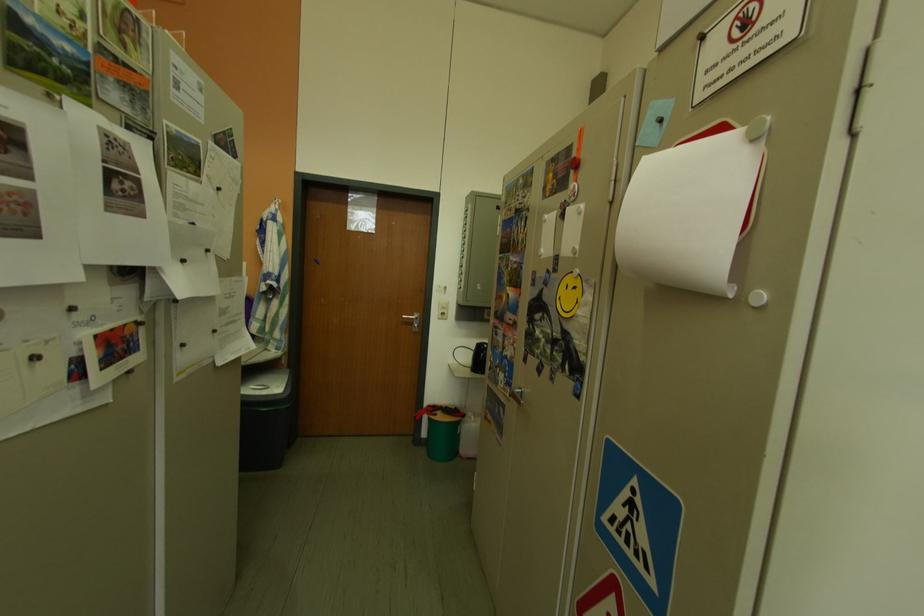
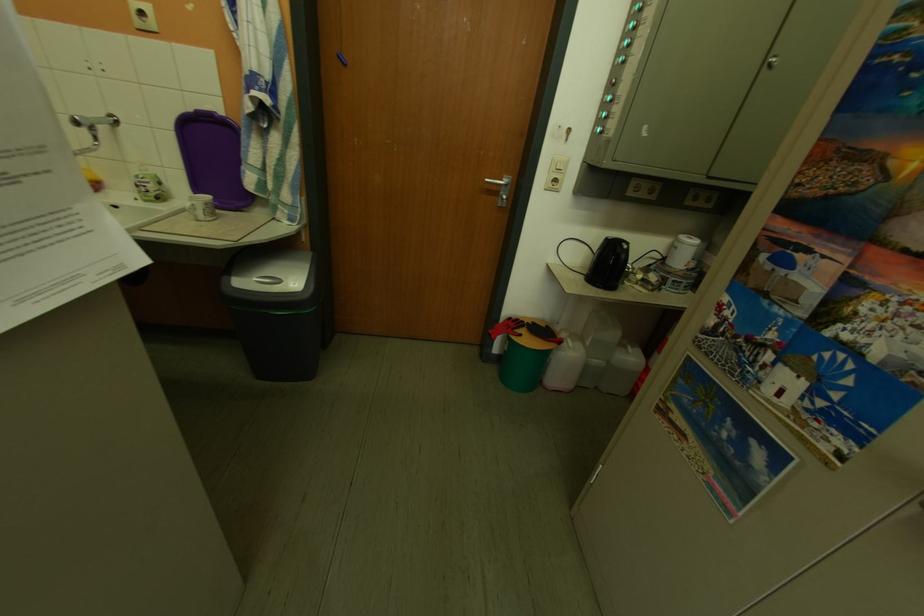
In the scene shown: Which direction would the cameraman need to move to produce the second image?

The cameraman walked toward left, forward.